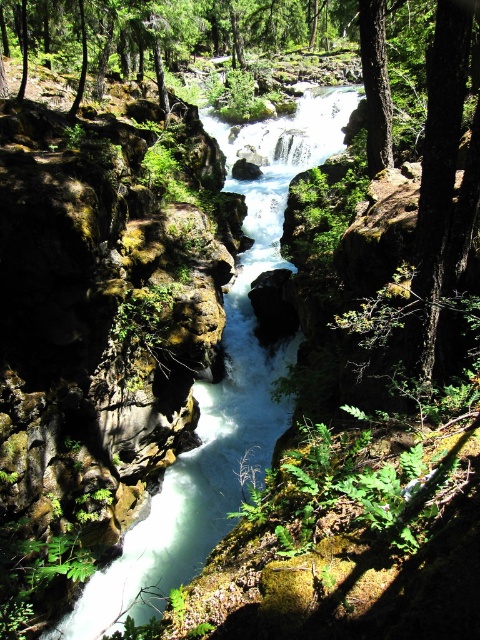
You are navigating a small boat downstream on the white smooth stream at center. To avoid hitting the rocky canyon walls, you need to stay within the stream. Based on the coordinates provided, can you determine if the stream is positioned centrally enough for safe passage?

The white smooth stream at center is located at coordinates point (220, 385), which suggests it is positioned centrally within the scene. This central positioning likely provides sufficient space on either side to avoid the rocky canyon walls, allowing for safe passage.

You are standing at the edge of the canyon and see the white smooth stream at center and the smooth dark brown tree trunk at upper center. Which object is located higher up in the scene?

The smooth dark brown tree trunk at upper center is located higher up in the scene than the white smooth stream at center.